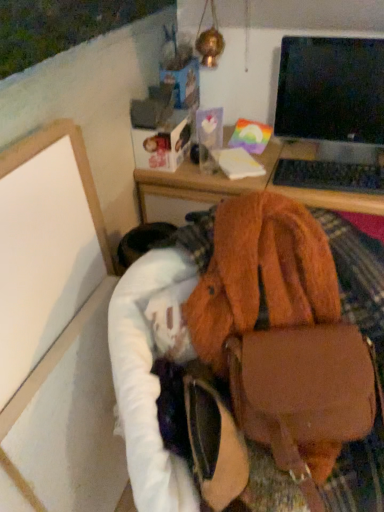
Find the location of a particular element. free location above black plastic keyboard at upper right (from a real-world perspective) is located at coordinates (342, 170).